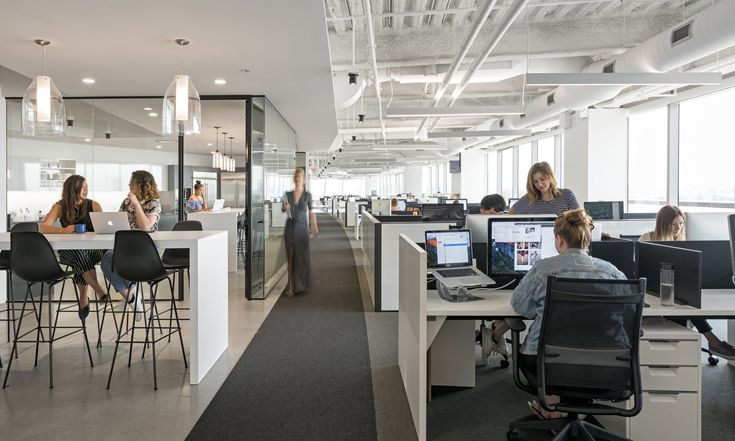
Find the location of a particular element. The image size is (735, 441). chairs is located at coordinates (35, 255), (153, 271), (173, 258), (112, 310), (96, 309), (597, 354), (709, 360).